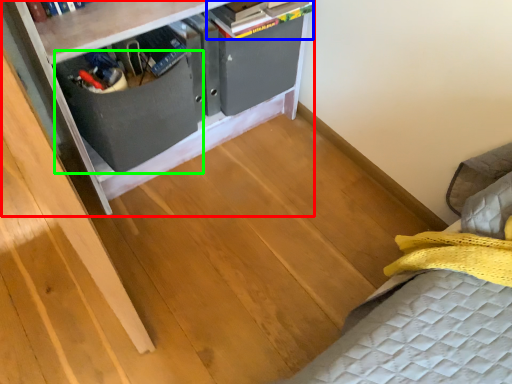
Question: Which is nearer to the furniture (highlighted by a red box)? book (highlighted by a blue box) or drawer (highlighted by a green box).

Choices:
 (A) book
 (B) drawer

Answer: (B)